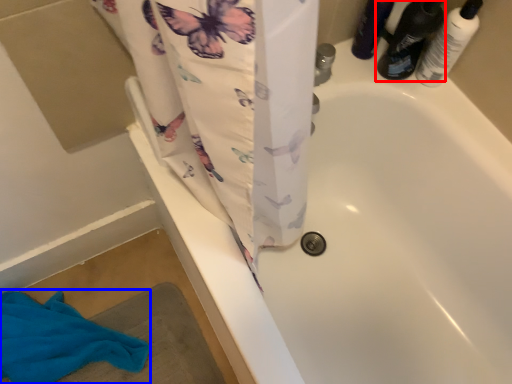
Question: Which object appears farthest to the camera in this image, footwear (highlighted by a red box) or beach towel (highlighted by a blue box)?

Choices:
 (A) footwear
 (B) beach towel

Answer: (B)